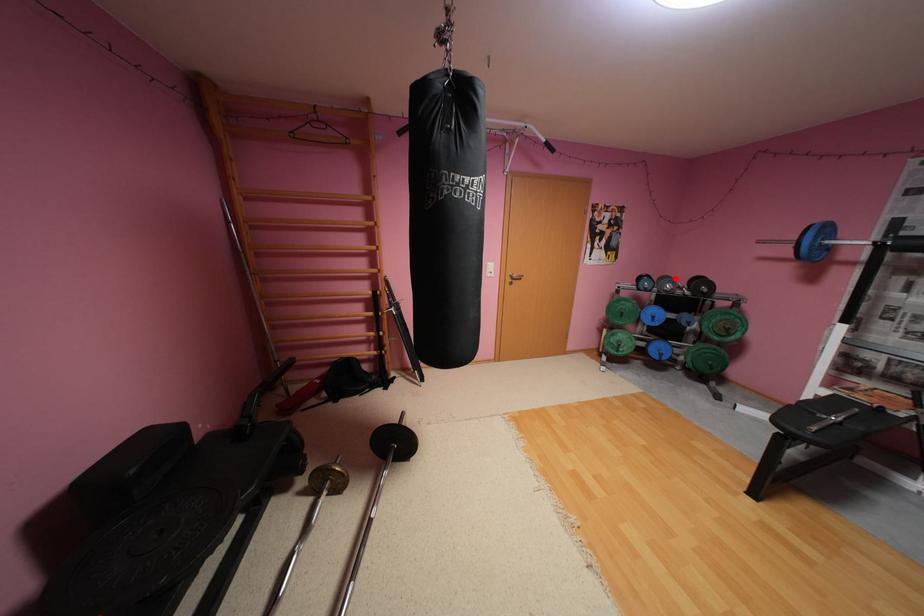
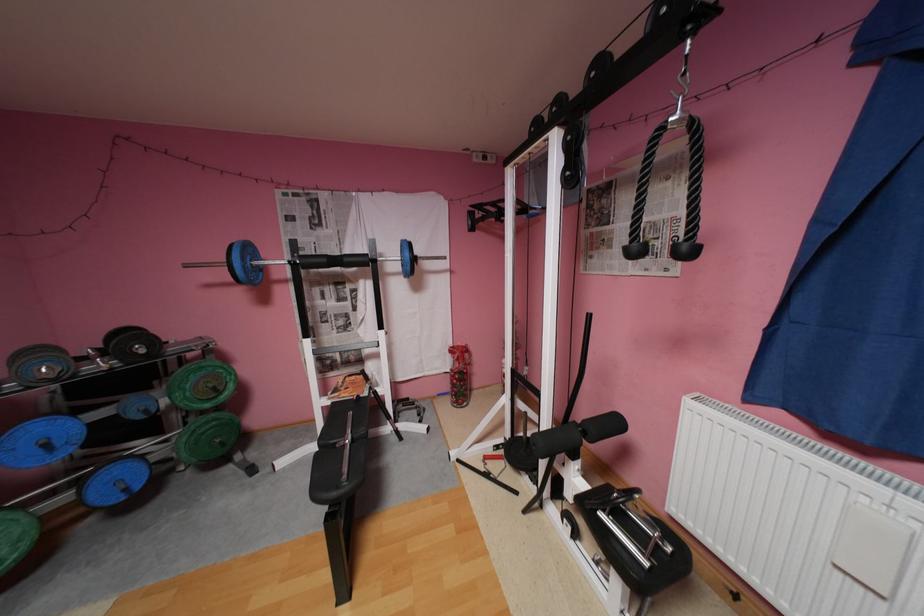
Find the pixel in the second image that matches the highlighted location in the first image.

(49, 351)